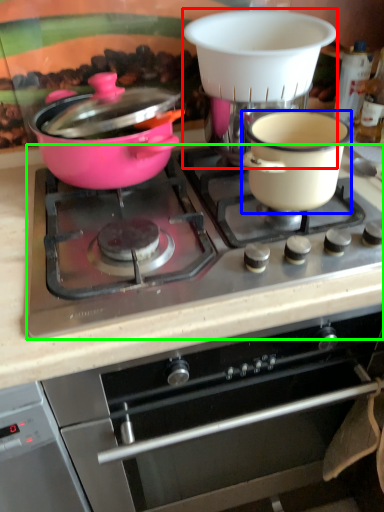
Question: Which object is positioned closest to coffee machine (highlighted by a red box)? Select from bowl (highlighted by a blue box) and gas stove (highlighted by a green box).

Choices:
 (A) bowl
 (B) gas stove

Answer: (A)